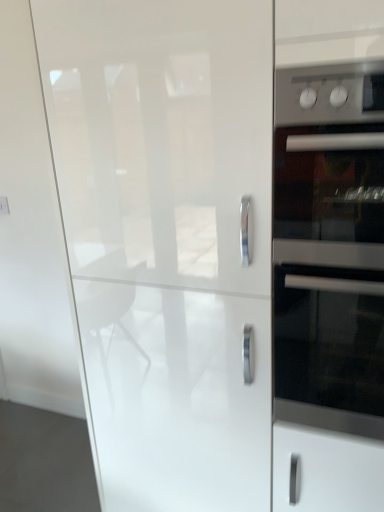
Question: Considering the relative sizes of glossy white cabinet at center and satin silver oven at right in the image provided, is glossy white cabinet at center smaller than satin silver oven at right?

Choices:
 (A) no
 (B) yes

Answer: (A)

Question: Is glossy white cabinet at center next to satin silver oven at right and touching it?

Choices:
 (A) yes
 (B) no

Answer: (B)

Question: Can you confirm if glossy white cabinet at center is wider than satin silver oven at right?

Choices:
 (A) no
 (B) yes

Answer: (B)

Question: Is glossy white cabinet at center positioned before satin silver oven at right?

Choices:
 (A) yes
 (B) no

Answer: (B)

Question: Is glossy white cabinet at center looking in the opposite direction of satin silver oven at right?

Choices:
 (A) yes
 (B) no

Answer: (B)

Question: Is stainless steel oven at right inside or outside of glossy white cabinet at center?

Choices:
 (A) outside
 (B) inside

Answer: (A)

Question: Is stainless steel oven at right bigger or smaller than glossy white cabinet at center?

Choices:
 (A) big
 (B) small

Answer: (B)

Question: In terms of height, does stainless steel oven at right look taller or shorter compared to glossy white cabinet at center?

Choices:
 (A) tall
 (B) short

Answer: (B)

Question: Considering the positions of stainless steel oven at right and glossy white cabinet at center in the image, is stainless steel oven at right wider or thinner than glossy white cabinet at center?

Choices:
 (A) wide
 (B) thin

Answer: (B)

Question: From a real-world perspective, is satin silver oven at right positioned above or below glossy white cabinet at center?

Choices:
 (A) above
 (B) below

Answer: (A)

Question: Based on their sizes in the image, would you say satin silver oven at right is bigger or smaller than glossy white cabinet at center?

Choices:
 (A) big
 (B) small

Answer: (B)

Question: In the image, is satin silver oven at right on the left side or the right side of glossy white cabinet at center?

Choices:
 (A) right
 (B) left

Answer: (A)

Question: From the image's perspective, relative to glossy white cabinet at center, is satin silver oven at right above or below?

Choices:
 (A) below
 (B) above

Answer: (B)

Question: Considering their positions, is satin silver oven at right located in front of or behind stainless steel oven at right?

Choices:
 (A) behind
 (B) front

Answer: (B)

Question: Visually, is satin silver oven at right positioned to the left or to the right of stainless steel oven at right?

Choices:
 (A) left
 (B) right

Answer: (A)